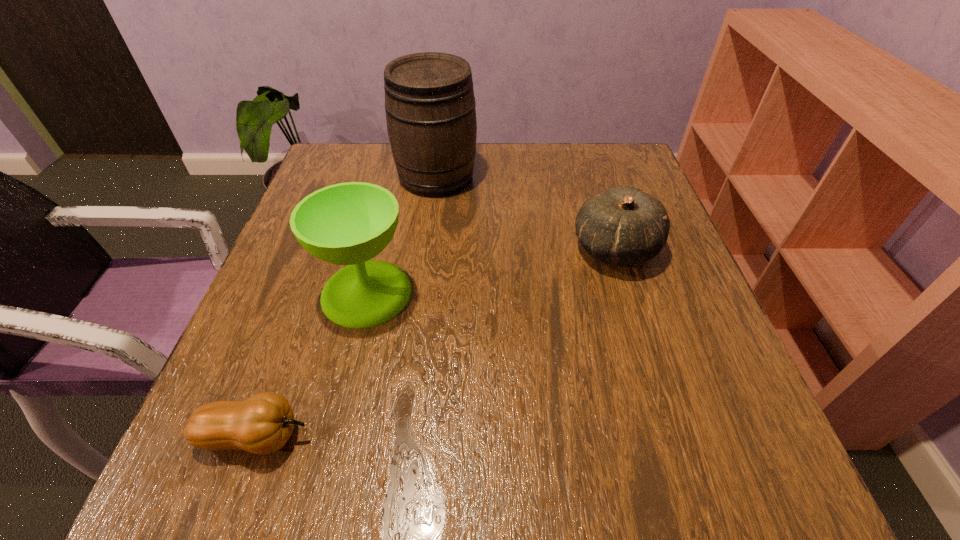
Image resolution: width=960 pixels, height=540 pixels. Find the location of `vacant area between the right gourd and the left gourd`. vacant area between the right gourd and the left gourd is located at coordinates (435, 342).

Locate an element on the screen. Image resolution: width=960 pixels, height=540 pixels. vacant point located between the second shortest object and the third shortest object is located at coordinates (491, 271).

Identify the location of object that is the closest to the wine bucket. The height and width of the screenshot is (540, 960). (350, 223).

Identify which object is the third closest to the third shortest object. Please provide its 2D coordinates. Your answer should be formatted as a tuple, i.e. [(x, y)], where the tuple contains the x and y coordinates of a point satisfying the conditions above.

[(624, 226)]

This screenshot has width=960, height=540. I want to click on vacant area that satisfies the following two spatial constraints: 1. on the front side of the wineglass; 2. on the stem side of the left gourd, so click(332, 436).

The height and width of the screenshot is (540, 960). I want to click on vacant space that satisfies the following two spatial constraints: 1. on the front side of the wine bucket; 2. on the stem side of the nearest object, so click(404, 436).

Locate an element on the screen. The image size is (960, 540). free space that satisfies the following two spatial constraints: 1. on the front side of the wineglass; 2. on the stem side of the shorter gourd is located at coordinates [332, 436].

At what (x,y) coordinates should I click in order to perform the action: click on vacant space that satisfies the following two spatial constraints: 1. on the front side of the taller gourd; 2. on the stem side of the left gourd. Please return your answer as a coordinate pair (x, y). Looking at the image, I should click on (673, 436).